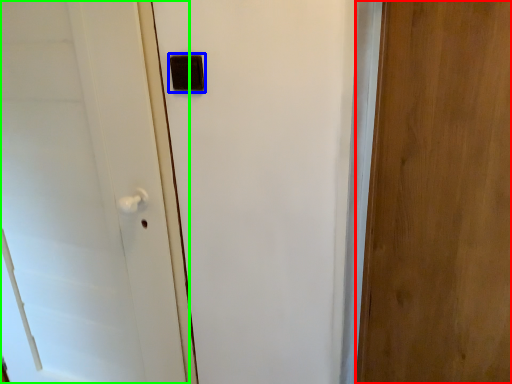
Question: Estimate the real-world distances between objects in this image. Which object is closer to door (highlighted by a red box), light switch (highlighted by a blue box) or door (highlighted by a green box)?

Choices:
 (A) light switch
 (B) door

Answer: (A)